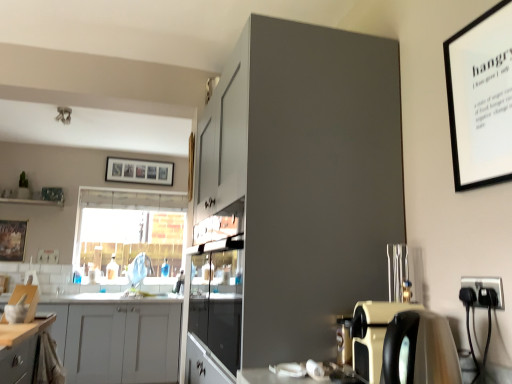
Locate an element on the screen. free point above wooden photo frame at upper center, placed as the first picture frame when sorted from right to left (from a real-world perspective) is located at coordinates (137, 156).